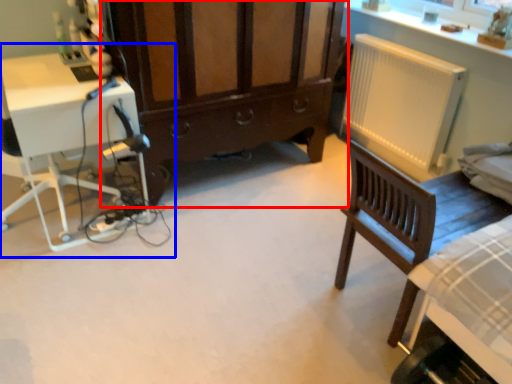
Question: Which point is closer to the camera, cabinetry (highlighted by a red box) or computer desk (highlighted by a blue box)?

Choices:
 (A) cabinetry
 (B) computer desk

Answer: (B)